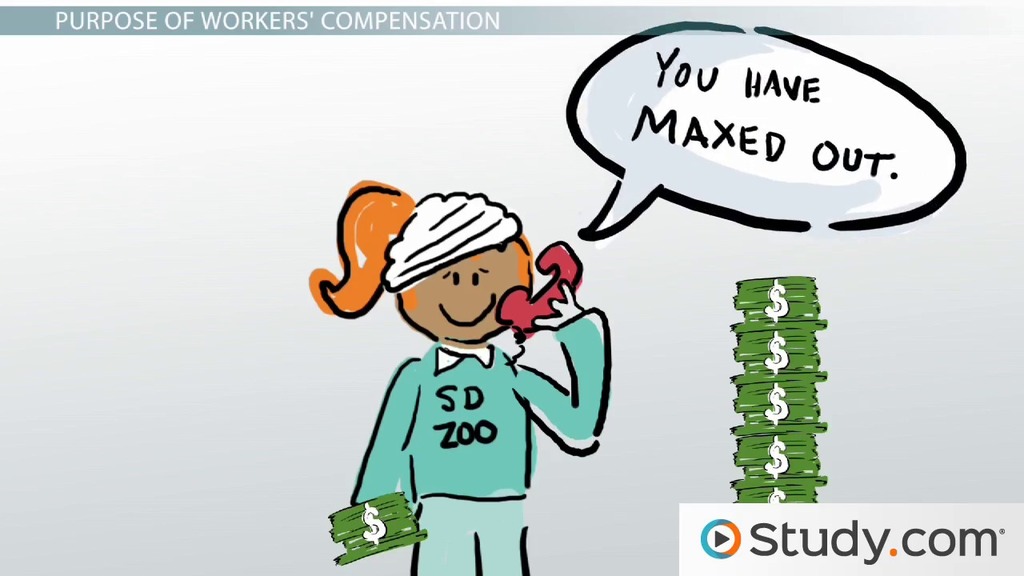
The image size is (1024, 576). In order to click on telephone in this screenshot , I will do coord(523,321).